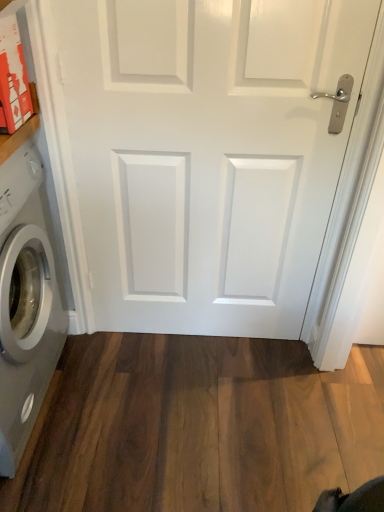
Question: From a real-world perspective, is white plastic washing machine at left positioned above or below brown wood flooring at lower center?

Choices:
 (A) below
 (B) above

Answer: (B)

Question: Does point (36, 151) appear closer or farther from the camera than point (119, 507)?

Choices:
 (A) farther
 (B) closer

Answer: (A)

Question: Which of these objects is positioned farthest from the brown wood flooring at lower center?

Choices:
 (A) white glossy door at center
 (B) white plastic washing machine at left

Answer: (A)

Question: Which is nearer to the brown wood flooring at lower center?

Choices:
 (A) white glossy door at center
 (B) white plastic washing machine at left

Answer: (B)